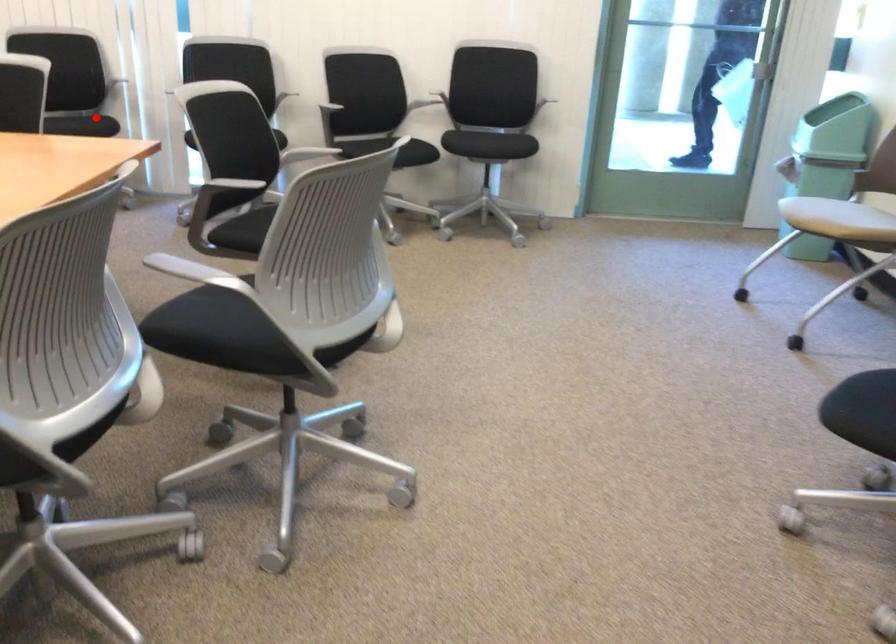
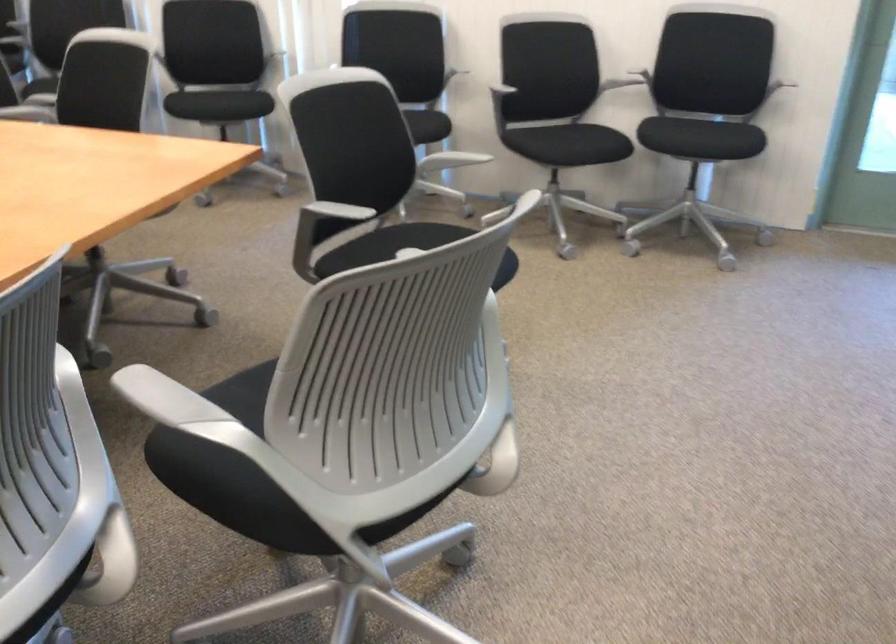
Question: I am providing you with two images of the same scene from different viewpoints. Image1 has a red point marked. In image2, the corresponding 3D location appears at what relative position? Reply with the corresponding letter.

Choices:
 (A) Closer
 (B) Farther

Answer: (A)